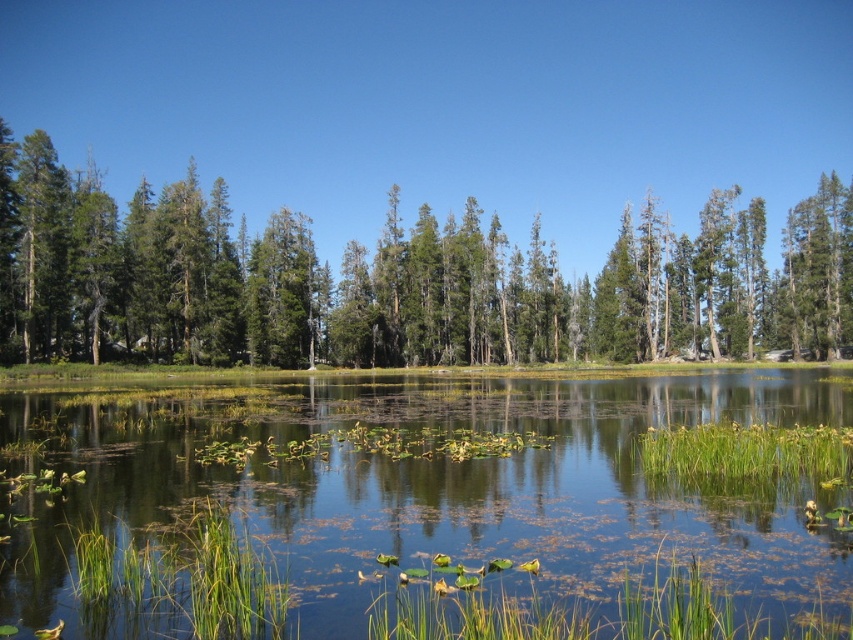
You are a drone operator trying to capture the best aerial shot of the green grassy lake at center. The camera is currently positioned at point A. To frame the lake properly, you need to adjust the camera to point directly at the lake. What coordinates should you aim the camera at?

The green grassy lake at center is located at coordinates point A at point A. To frame the lake properly, you should aim the camera at point A at point A.